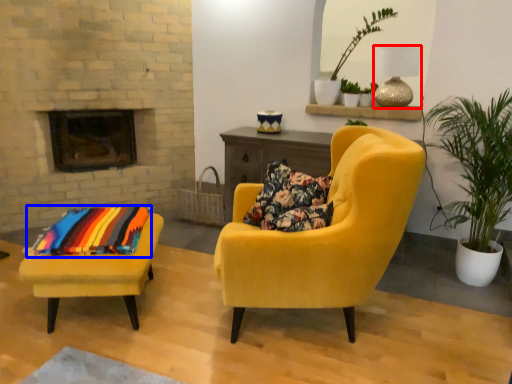
Question: Which of the following is the farthest to the observer, lamp (highlighted by a red box) or blanket (highlighted by a blue box)?

Choices:
 (A) lamp
 (B) blanket

Answer: (A)